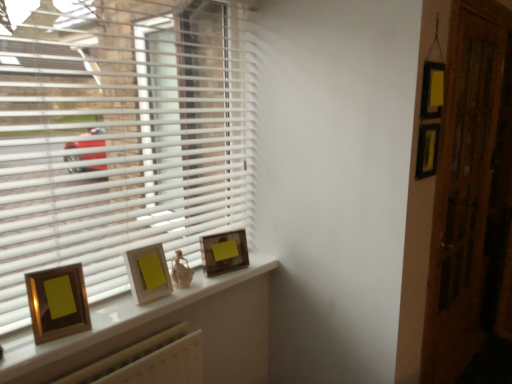
Where is `vacant space to the right of matte gold picture frame at center, marked as the 2th picture frame in a left-to-right arrangement`? This screenshot has height=384, width=512. vacant space to the right of matte gold picture frame at center, marked as the 2th picture frame in a left-to-right arrangement is located at coordinates (190, 294).